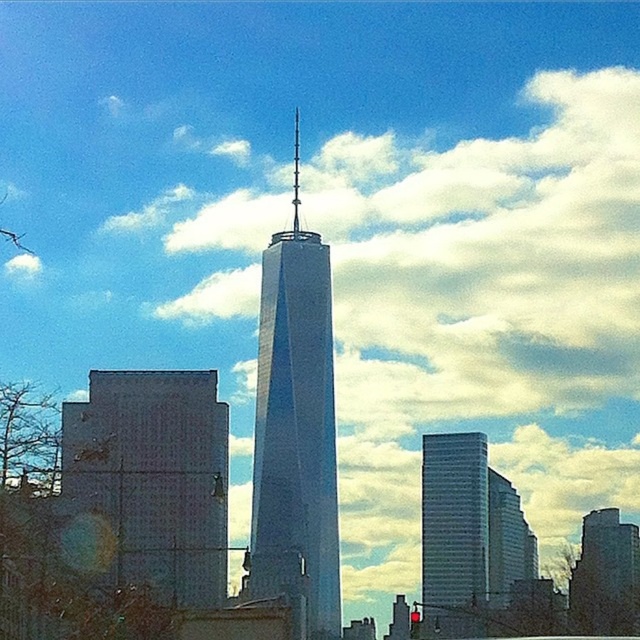
Question: Which point is farther to the camera?

Choices:
 (A) gray concrete building at lower left
 (B) glassy white skyscraper at center

Answer: (B)

Question: Among these objects, which one is nearest to the camera?

Choices:
 (A) gray concrete building at lower left
 (B) glassy steel skyscraper at center
 (C) glassy white skyscraper at center

Answer: (B)

Question: Based on their relative distances, which object is farther from the glassy steel skyscraper at center?

Choices:
 (A) gray concrete building at lower left
 (B) dark gray stone tower at center
 (C) glassy white skyscraper at center

Answer: (B)

Question: Is glassy steel skyscraper at center above dark gray stone tower at center?

Choices:
 (A) no
 (B) yes

Answer: (B)

Question: From the image, what is the correct spatial relationship of glassy steel skyscraper at center in relation to glassy white skyscraper at center?

Choices:
 (A) left
 (B) right

Answer: (A)

Question: Is the position of gray concrete building at lower left more distant than that of glassy white skyscraper at center?

Choices:
 (A) no
 (B) yes

Answer: (A)